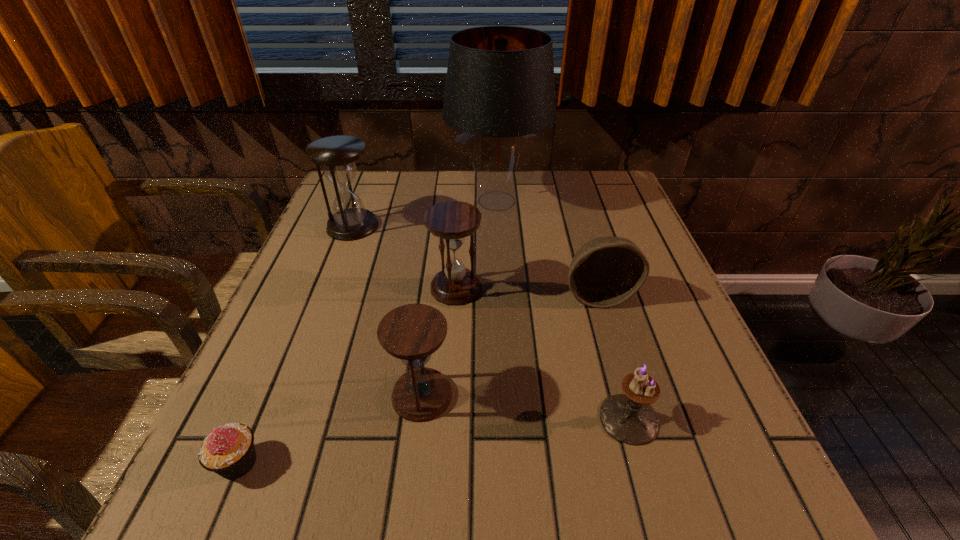
Where is `free point located 0.160m on the right of the nearest hourglass`? The width and height of the screenshot is (960, 540). free point located 0.160m on the right of the nearest hourglass is located at coordinates (546, 395).

Where is `free space located 0.210m on the front of the bowl`? free space located 0.210m on the front of the bowl is located at coordinates (628, 397).

Find the location of `free space located on the left of the sixth tallest object`. free space located on the left of the sixth tallest object is located at coordinates (428, 419).

Find the location of a particular element. The height and width of the screenshot is (540, 960). vacant space situated on the back of the shortest object is located at coordinates (289, 342).

Where is `lampshade located in the far edge section of the desktop`? The height and width of the screenshot is (540, 960). lampshade located in the far edge section of the desktop is located at coordinates (500, 90).

The image size is (960, 540). Find the location of `hourglass that is at the far edge`. hourglass that is at the far edge is located at coordinates (337, 155).

Where is `object that is at the near edge`? The image size is (960, 540). object that is at the near edge is located at coordinates (229, 451).

Where is `hourglass that is at the left edge`? hourglass that is at the left edge is located at coordinates (337, 155).

Locate an element on the screen. cupcake positioned at the left edge is located at coordinates (229, 451).

The image size is (960, 540). Identify the location of bowl that is at the right edge. click(605, 272).